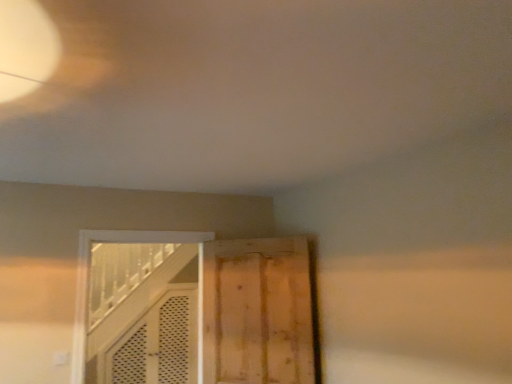
What are the coordinates of `white wooden door at center, the second door in the right-to-left sequence` in the screenshot? It's located at (141, 314).

The image size is (512, 384). Describe the element at coordinates (141, 314) in the screenshot. I see `white wooden door at center, the 1th door in the left-to-right sequence` at that location.

The width and height of the screenshot is (512, 384). Describe the element at coordinates (257, 312) in the screenshot. I see `wooden door at center, positioned as the first door in right-to-left order` at that location.

This screenshot has width=512, height=384. I want to click on wooden door at center, acting as the second door starting from the left, so click(x=257, y=312).

What is the approximate width of wooden door at center, acting as the second door starting from the left?

It is 3.06 inches.

What are the coordinates of `white wooden door at center, the 1th door in the left-to-right sequence` in the screenshot? It's located at (141, 314).

Which is more to the left, wooden door at center, acting as the second door starting from the left, or white wooden door at center, the 1th door in the left-to-right sequence?

white wooden door at center, the 1th door in the left-to-right sequence.

Considering the relative positions of wooden door at center, acting as the second door starting from the left, and white wooden door at center, the second door in the right-to-left sequence, in the image provided, is wooden door at center, acting as the second door starting from the left, behind white wooden door at center, the second door in the right-to-left sequence,?

Yes.

Is point (251, 380) closer or farther from the camera than point (124, 310)?

Point (251, 380) is positioned closer to the camera compared to point (124, 310).

From the image's perspective, is wooden door at center, acting as the second door starting from the left, beneath white wooden door at center, the second door in the right-to-left sequence?

Incorrect, from the image's perspective, wooden door at center, acting as the second door starting from the left, is higher than white wooden door at center, the second door in the right-to-left sequence.

From a real-world perspective, relative to white wooden door at center, the 1th door in the left-to-right sequence, is wooden door at center, acting as the second door starting from the left, vertically above or below?

Clearly, from a real-world perspective, wooden door at center, acting as the second door starting from the left, is below white wooden door at center, the 1th door in the left-to-right sequence.

Considering the sizes of objects wooden door at center, positioned as the first door in right-to-left order, and white wooden door at center, the 1th door in the left-to-right sequence, in the image provided, who is wider, wooden door at center, positioned as the first door in right-to-left order, or white wooden door at center, the 1th door in the left-to-right sequence,?

white wooden door at center, the 1th door in the left-to-right sequence, is wider.

Considering the relative sizes of wooden door at center, acting as the second door starting from the left, and white wooden door at center, the 1th door in the left-to-right sequence, in the image provided, is wooden door at center, acting as the second door starting from the left, taller than white wooden door at center, the 1th door in the left-to-right sequence,?

No.

Does wooden door at center, acting as the second door starting from the left, have a larger size compared to white wooden door at center, the second door in the right-to-left sequence?

Actually, wooden door at center, acting as the second door starting from the left, might be smaller than white wooden door at center, the second door in the right-to-left sequence.

Is wooden door at center, positioned as the first door in right-to-left order, surrounding white wooden door at center, the second door in the right-to-left sequence?

That's incorrect, white wooden door at center, the second door in the right-to-left sequence, is not inside wooden door at center, positioned as the first door in right-to-left order.

Is wooden door at center, acting as the second door starting from the left, beside white wooden door at center, the second door in the right-to-left sequence?

No, wooden door at center, acting as the second door starting from the left, is not making contact with white wooden door at center, the second door in the right-to-left sequence.

Is white wooden door at center, the 1th door in the left-to-right sequence, at the back of wooden door at center, acting as the second door starting from the left?

No, wooden door at center, acting as the second door starting from the left, is not facing away from white wooden door at center, the 1th door in the left-to-right sequence.

How different are the orientations of wooden door at center, positioned as the first door in right-to-left order, and white wooden door at center, the 1th door in the left-to-right sequence, in degrees?

The angular difference between wooden door at center, positioned as the first door in right-to-left order, and white wooden door at center, the 1th door in the left-to-right sequence, is 46.2 degrees.

How far apart are wooden door at center, acting as the second door starting from the left, and white wooden door at center, the 1th door in the left-to-right sequence?

A distance of 5.77 feet exists between wooden door at center, acting as the second door starting from the left, and white wooden door at center, the 1th door in the left-to-right sequence.

Locate an element on the screen. door located in front of the wooden door at center, acting as the second door starting from the left is located at coordinates (141, 314).

Would you say white wooden door at center, the second door in the right-to-left sequence, is to the left or to the right of wooden door at center, acting as the second door starting from the left, in the picture?

Clearly, white wooden door at center, the second door in the right-to-left sequence, is on the left of wooden door at center, acting as the second door starting from the left, in the image.

In the image, is white wooden door at center, the second door in the right-to-left sequence, positioned in front of or behind wooden door at center, acting as the second door starting from the left?

white wooden door at center, the second door in the right-to-left sequence, is in front of wooden door at center, acting as the second door starting from the left.

Is point (86, 340) behind point (246, 315)?

Yes, point (86, 340) is behind point (246, 315).

From the image's perspective, is white wooden door at center, the 1th door in the left-to-right sequence, above or below wooden door at center, positioned as the first door in right-to-left order?

Clearly, from the image's perspective, white wooden door at center, the 1th door in the left-to-right sequence, is below wooden door at center, positioned as the first door in right-to-left order.

From a real-world perspective, which is physically below, white wooden door at center, the 1th door in the left-to-right sequence, or wooden door at center, positioned as the first door in right-to-left order?

From a 3D spatial view, wooden door at center, positioned as the first door in right-to-left order, is below.

Which of these two, white wooden door at center, the second door in the right-to-left sequence, or wooden door at center, positioned as the first door in right-to-left order, is wider?

white wooden door at center, the second door in the right-to-left sequence.

Which of these two, white wooden door at center, the 1th door in the left-to-right sequence, or wooden door at center, positioned as the first door in right-to-left order, stands taller?

Standing taller between the two is white wooden door at center, the 1th door in the left-to-right sequence.

In terms of size, does white wooden door at center, the second door in the right-to-left sequence, appear bigger or smaller than wooden door at center, acting as the second door starting from the left?

Clearly, white wooden door at center, the second door in the right-to-left sequence, is larger in size than wooden door at center, acting as the second door starting from the left.

Can we say white wooden door at center, the 1th door in the left-to-right sequence, lies outside wooden door at center, positioned as the first door in right-to-left order?

Yes, white wooden door at center, the 1th door in the left-to-right sequence, is located beyond the bounds of wooden door at center, positioned as the first door in right-to-left order.

Is white wooden door at center, the 1th door in the left-to-right sequence, next to wooden door at center, positioned as the first door in right-to-left order?

No, white wooden door at center, the 1th door in the left-to-right sequence, is not touching wooden door at center, positioned as the first door in right-to-left order.

Is white wooden door at center, the second door in the right-to-left sequence, aimed at wooden door at center, positioned as the first door in right-to-left order?

No, white wooden door at center, the second door in the right-to-left sequence, is not turned towards wooden door at center, positioned as the first door in right-to-left order.

Identify the location of door below the wooden door at center, acting as the second door starting from the left (from the image's perspective). (141, 314).

You are a GUI agent. You are given a task and a screenshot of the screen. Output one action in this format:
    pyautogui.click(x=<x>, y=<y>)
    Task: Click on the door that is on the right side of white wooden door at center, the 1th door in the left-to-right sequence
    This screenshot has width=512, height=384.
    Given the screenshot: What is the action you would take?
    pyautogui.click(x=257, y=312)

Identify the location of door that is behind the white wooden door at center, the 1th door in the left-to-right sequence. (257, 312).